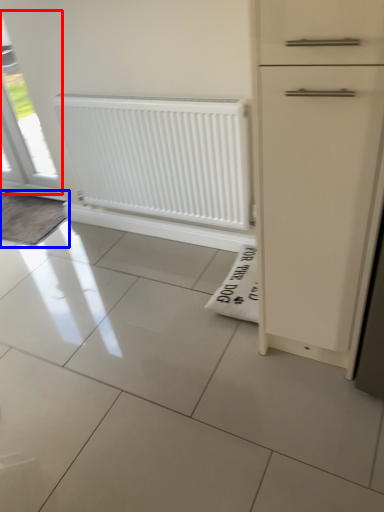
Question: Which object is further to the camera taking this photo, window (highlighted by a red box) or doormat (highlighted by a blue box)?

Choices:
 (A) window
 (B) doormat

Answer: (B)